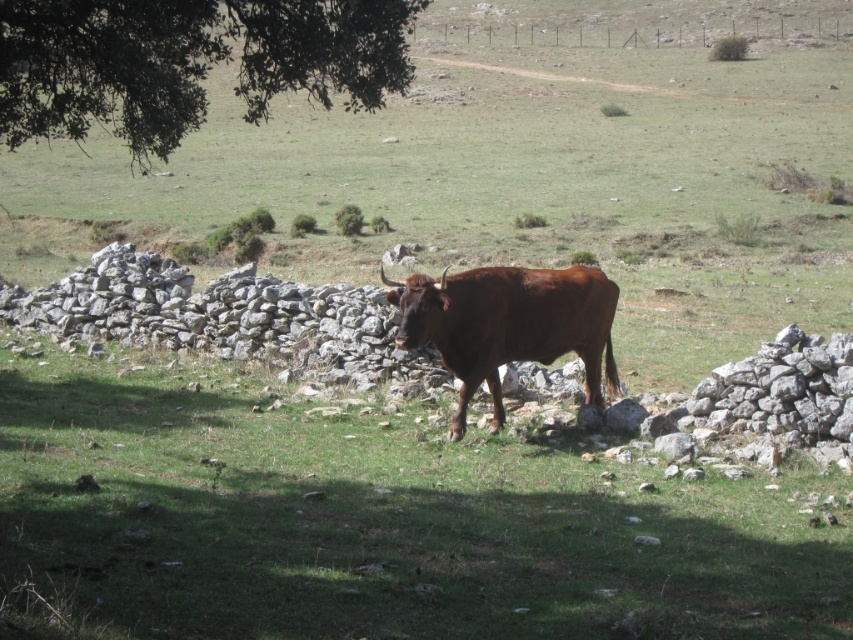
Question: Does brown grassy at center appear on the right side of green leafy tree at upper left?

Choices:
 (A) no
 (B) yes

Answer: (B)

Question: Does green leafy tree at upper left appear over brown glossy bull at center?

Choices:
 (A) no
 (B) yes

Answer: (B)

Question: Is green leafy tree at upper left above brown glossy bull at center?

Choices:
 (A) no
 (B) yes

Answer: (B)

Question: Which of these objects is positioned closest to the brown glossy bull at center?

Choices:
 (A) brown grassy at center
 (B) green leafy tree at upper left

Answer: (A)

Question: Which of the following is the closest to the observer?

Choices:
 (A) (584, 317)
 (B) (454, 602)
 (C) (140, 0)

Answer: (B)

Question: Which of the following is the farthest from the observer?

Choices:
 (A) (317, 554)
 (B) (561, 294)
 (C) (323, 48)

Answer: (B)